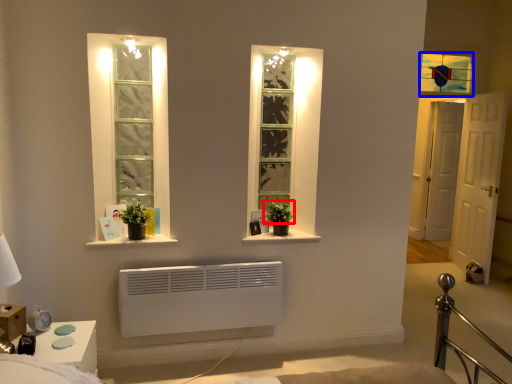
Question: Which point is further to the camera, plant (highlighted by a red box) or window (highlighted by a blue box)?

Choices:
 (A) plant
 (B) window

Answer: (B)